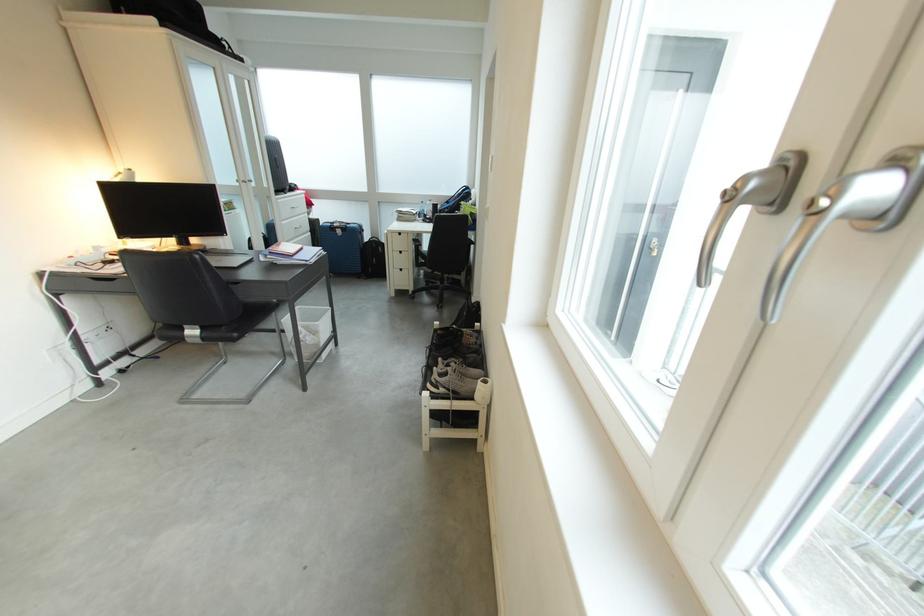
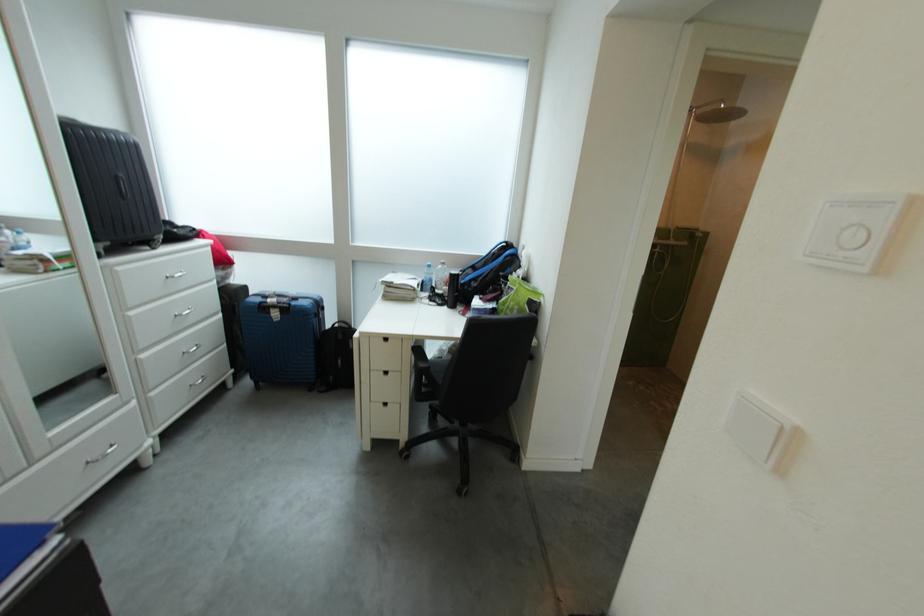
Question: In a continuous first-person perspective shot, in which direction is the camera moving?

Choices:
 (A) Left
 (B) Right
 (C) Forward
 (D) Backward

Answer: (C)